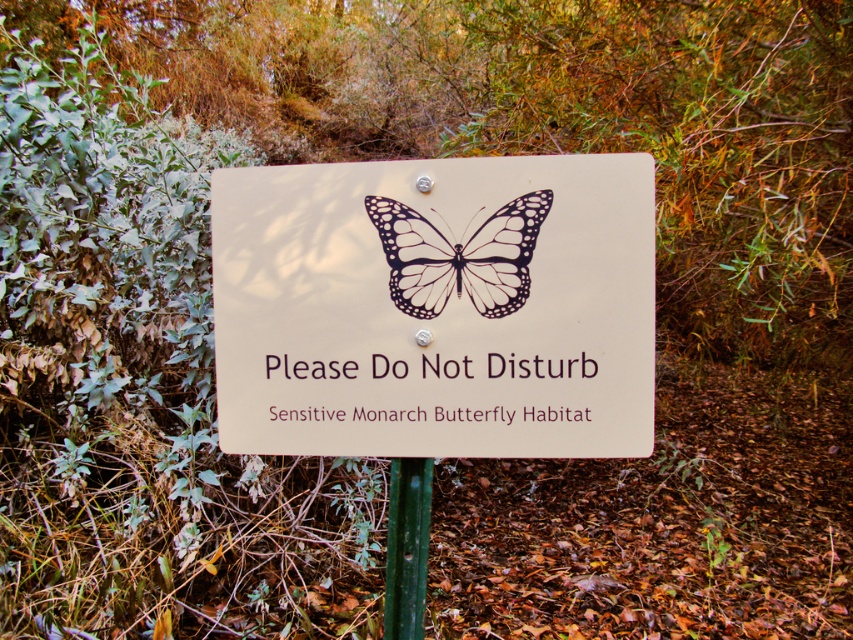
Is point (456, 268) positioned after point (404, 461)?

No, (456, 268) is closer to viewer.

Is black matte butterfly at center thinner than green metallic pole at center?

In fact, black matte butterfly at center might be wider than green metallic pole at center.

Find the location of a particular element. black matte butterfly at center is located at coordinates (459, 257).

Which is below, beige plastic sign at center or green metallic pole at center?

green metallic pole at center is lower down.

Can you confirm if beige plastic sign at center is positioned to the right of green metallic pole at center?

Indeed, beige plastic sign at center is positioned on the right side of green metallic pole at center.

Find the location of a particular element. beige plastic sign at center is located at coordinates (436, 307).

Where is `beige plastic sign at center`? The height and width of the screenshot is (640, 853). beige plastic sign at center is located at coordinates (436, 307).

Locate an element on the screen. The width and height of the screenshot is (853, 640). beige plastic sign at center is located at coordinates (436, 307).

The image size is (853, 640). Find the location of `beige plastic sign at center`. beige plastic sign at center is located at coordinates (436, 307).